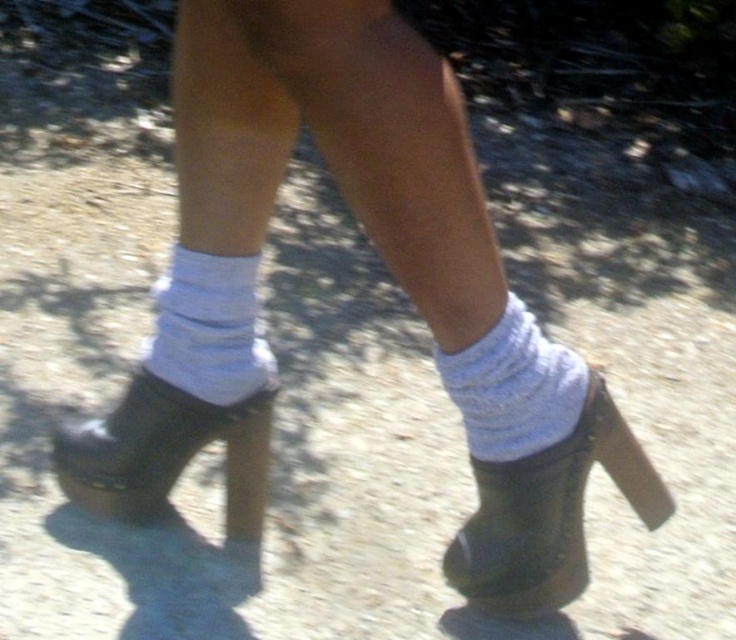
Is white fabric boot at center above white knitted sock at lower center?

No, white fabric boot at center is not above white knitted sock at lower center.

Does point (542, 502) lie in front of point (562, 388)?

No, it is not.

Identify the location of white fabric boot at center. The image size is (736, 640). (548, 513).

Measure the distance between matte olive green boot at lower left and white knitted sock at lower center.

A distance of 17.21 inches exists between matte olive green boot at lower left and white knitted sock at lower center.

Is point (127, 422) in front of point (539, 356)?

No, it is behind (539, 356).

Identify the location of matte olive green boot at lower left. Image resolution: width=736 pixels, height=640 pixels. (166, 452).

Between point (177, 406) and point (251, 385), which one is positioned in front?

Point (251, 385)

Is matte olive green boot at lower left smaller than white ribbed sock at center?

No, matte olive green boot at lower left is not smaller than white ribbed sock at center.

What are the coordinates of `matte olive green boot at lower left` in the screenshot? It's located at (166, 452).